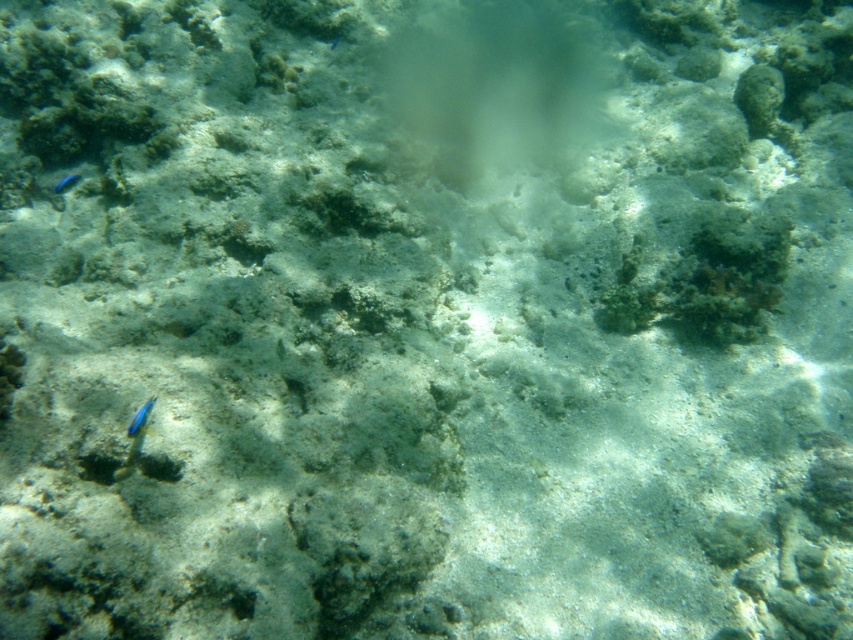
You are a diver observing the underwater scene. You notice two blue glossy fish in the image. Which one is positioned closer to you, the blue glossy fish at lower left or the blue glossy fish at upper left?

The blue glossy fish at lower left is closer to the viewer than the blue glossy fish at upper left.